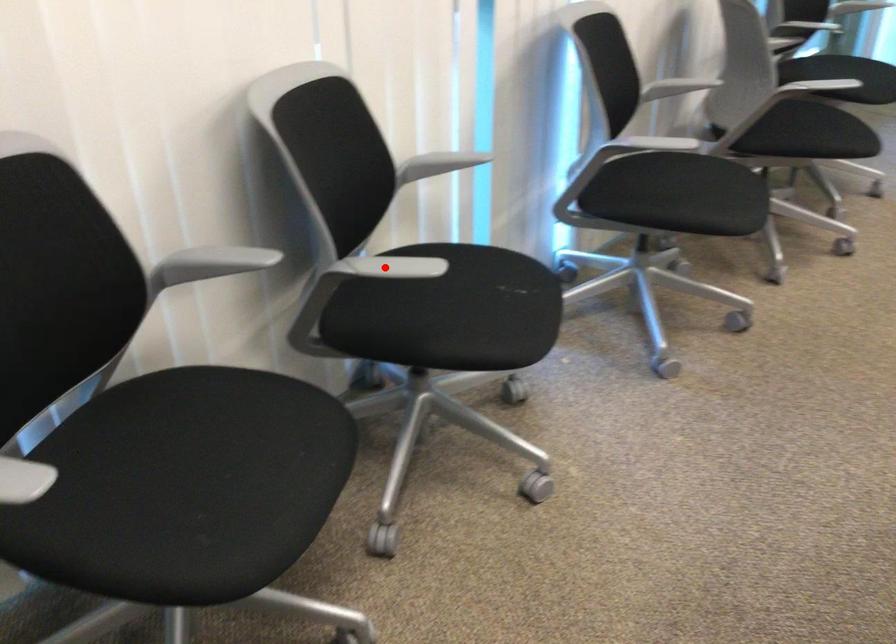
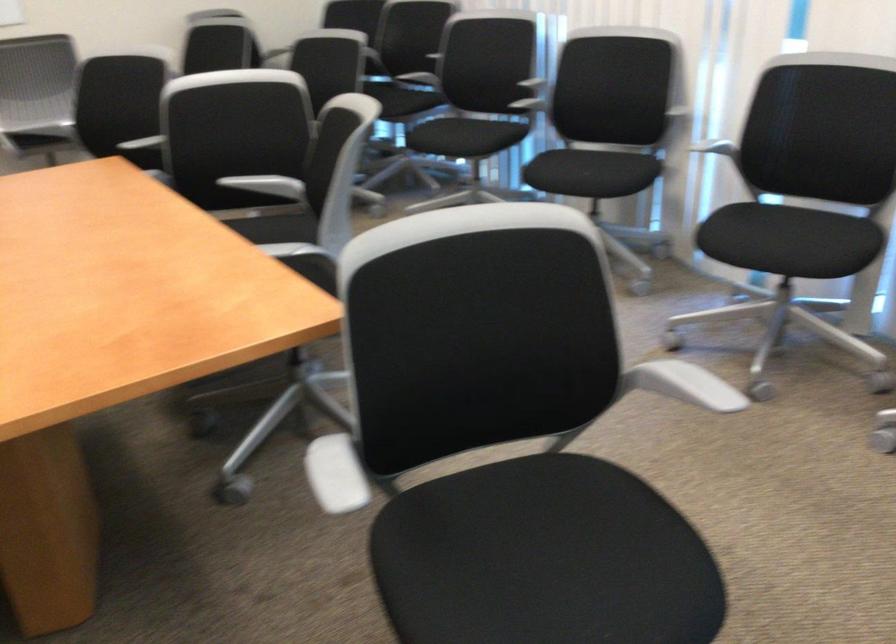
Question: I am providing you with two images of the same scene from different viewpoints. A red point is marked on the first image. Can you still see the location of the red point in image 2?

Choices:
 (A) Yes
 (B) No

Answer: (B)